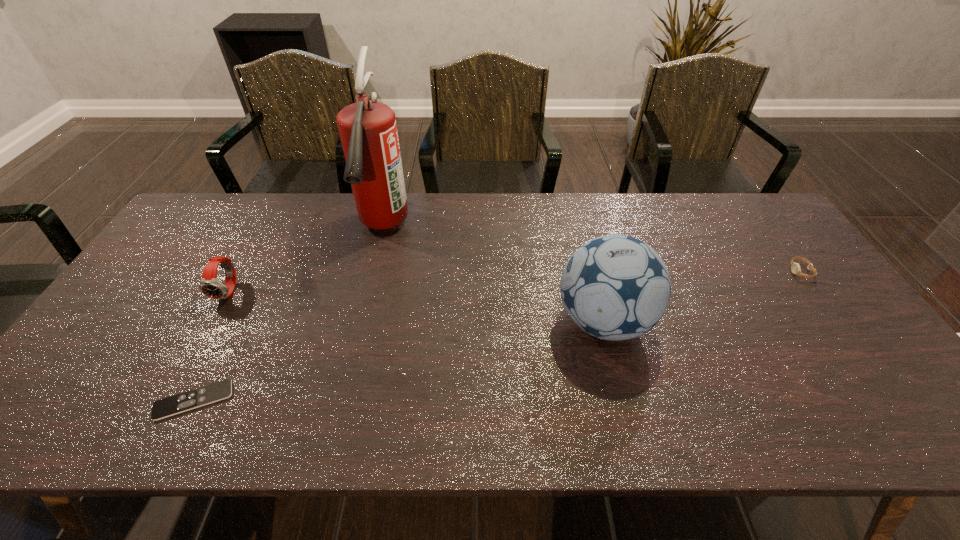
This screenshot has width=960, height=540. I want to click on object situated at the near edge, so click(166, 407).

The height and width of the screenshot is (540, 960). In order to click on object positioned at the right edge in this screenshot , I will do [795, 267].

This screenshot has width=960, height=540. Identify the location of vacant area at the far edge of the desktop. (270, 227).

Where is `vacant space at the near edge`? This screenshot has height=540, width=960. vacant space at the near edge is located at coordinates (274, 433).

Find the location of a particular element. The height and width of the screenshot is (540, 960). vacant area at the left edge is located at coordinates (136, 290).

Find the location of a particular element. vacant space at the right edge of the desktop is located at coordinates (818, 340).

In the image, there is a desktop. Identify the location of blank space at the far right corner. The image size is (960, 540). (733, 218).

Where is `free space at the near right corner of the desktop`? Image resolution: width=960 pixels, height=540 pixels. free space at the near right corner of the desktop is located at coordinates (912, 429).

Locate an element on the screen. vacant area that lies between the third tallest object and the shortest object is located at coordinates (212, 346).

This screenshot has height=540, width=960. I want to click on free space between the soccer ball and the taller watch, so click(417, 306).